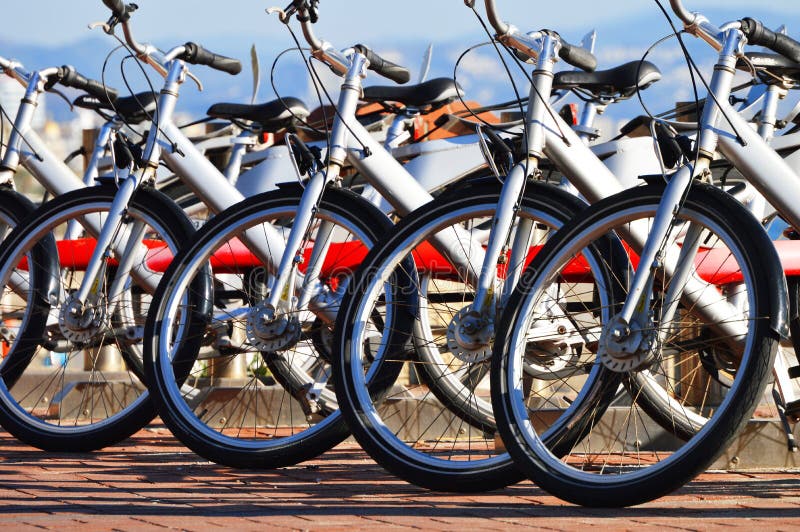
I want to click on handles, so click(785, 52), click(582, 49), click(394, 65), click(220, 59), click(90, 84).